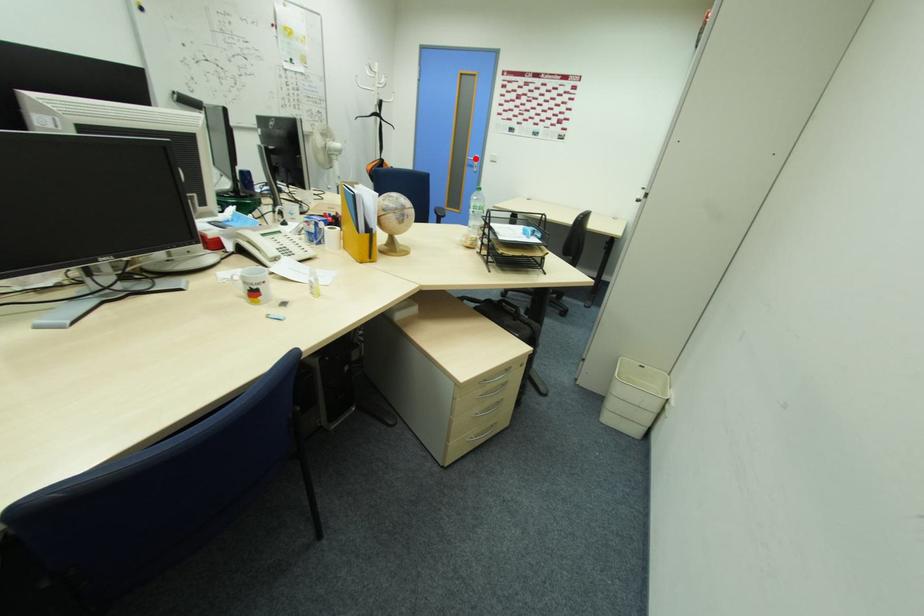
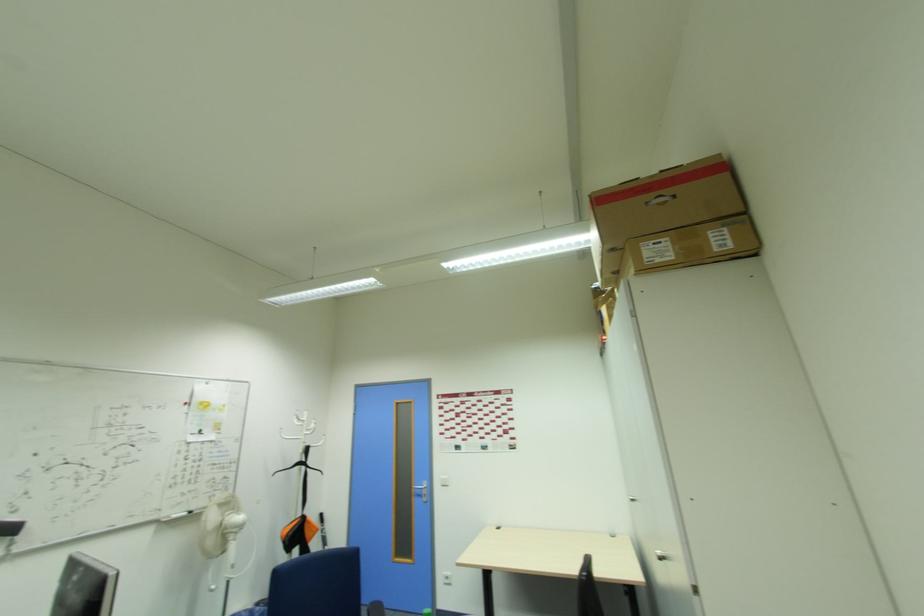
Question: I am providing you with two images of the same scene from different viewpoints. A red point is shown in image1. For the corresponding object point in image2, is it positioned nearer or farther from the camera?

Choices:
 (A) Nearer
 (B) Farther

Answer: (B)